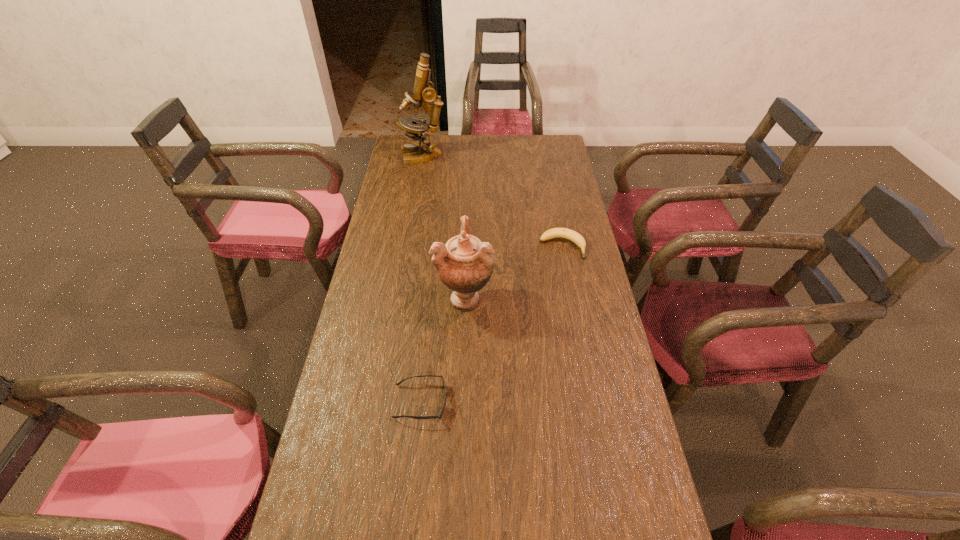
The height and width of the screenshot is (540, 960). In order to click on vacant area situated 0.090m on the front-facing side of the nearest object in this screenshot , I will do click(483, 402).

You are a GUI agent. You are given a task and a screenshot of the screen. Output one action in this format:
    pyautogui.click(x=<x>, y=<y>)
    Task: Click on the object present at the far edge
    Image resolution: width=960 pixels, height=540 pixels.
    Given the screenshot: What is the action you would take?
    pyautogui.click(x=423, y=92)

Locate an element on the screen. Image resolution: width=960 pixels, height=540 pixels. microscope positioned at the left edge is located at coordinates (423, 92).

Image resolution: width=960 pixels, height=540 pixels. Identify the location of sunglasses that is at the left edge. (440, 415).

In order to click on object located at the right edge in this screenshot , I will do `click(576, 238)`.

You are a GUI agent. You are given a task and a screenshot of the screen. Output one action in this format:
    pyautogui.click(x=<x>, y=<y>)
    Task: Click on the object at the far left corner
    
    Given the screenshot: What is the action you would take?
    pyautogui.click(x=423, y=92)

Find the location of a particular element. The width and height of the screenshot is (960, 540). free space at the far edge is located at coordinates (505, 161).

Locate an element on the screen. This screenshot has height=540, width=960. vacant area at the left edge is located at coordinates (396, 201).

Where is `vacant space at the right edge of the desktop`? Image resolution: width=960 pixels, height=540 pixels. vacant space at the right edge of the desktop is located at coordinates (608, 376).

Locate an element on the screen. vacant space at the far right corner of the desktop is located at coordinates (561, 158).